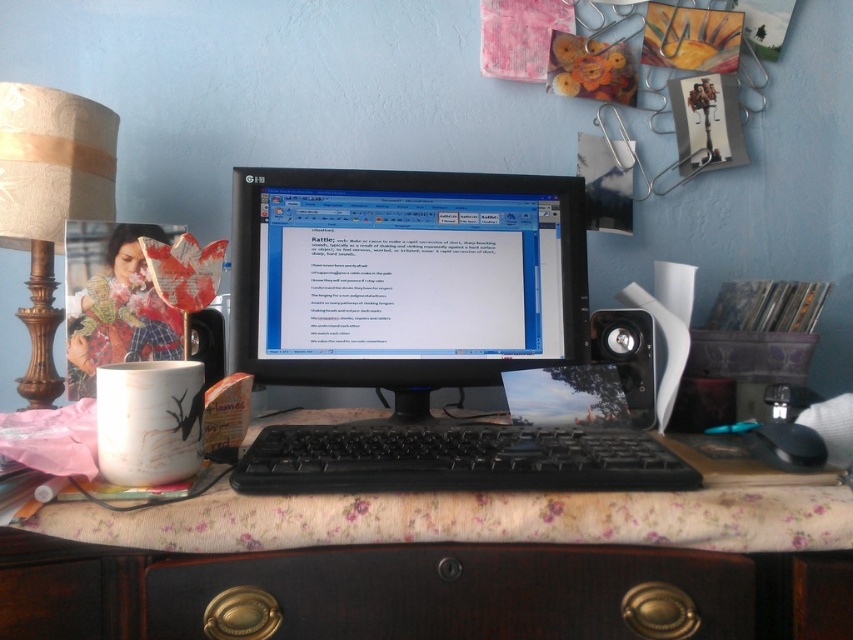
Question: Does dark wood drawer at lower center have a larger size compared to black plastic keyboard at center?

Choices:
 (A) no
 (B) yes

Answer: (A)

Question: Does dark wood drawer at lower center lie in front of white matte mug at center?

Choices:
 (A) no
 (B) yes

Answer: (B)

Question: Can you confirm if black plastic keyboard at center is wider than beige fabric lampshade at left?

Choices:
 (A) yes
 (B) no

Answer: (A)

Question: Which point is farther to the camera?

Choices:
 (A) black plastic keyboard at center
 (B) floral fabric computer desk at center

Answer: (A)

Question: Which of the following is the farthest from the observer?

Choices:
 (A) (788, 433)
 (B) (413, 172)

Answer: (B)

Question: Which point is farther to the camera?

Choices:
 (A) (160, 397)
 (B) (606, 476)

Answer: (B)